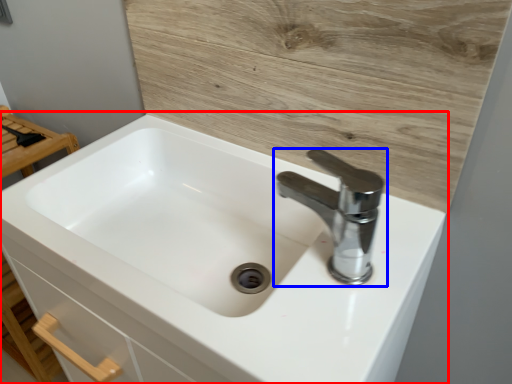
Question: Which point is further to the camera, sink (highlighted by a red box) or tap (highlighted by a blue box)?

Choices:
 (A) sink
 (B) tap

Answer: (B)